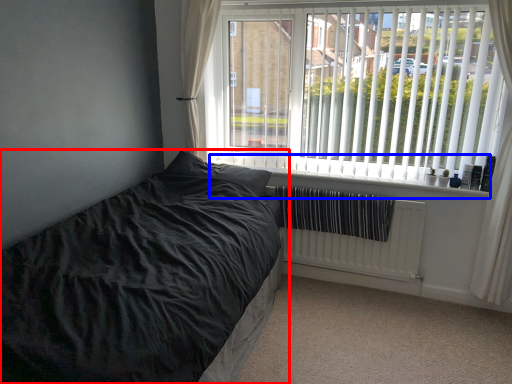
Question: Which object is further to the camera taking this photo, bed (highlighted by a red box) or window sill (highlighted by a blue box)?

Choices:
 (A) bed
 (B) window sill

Answer: (B)